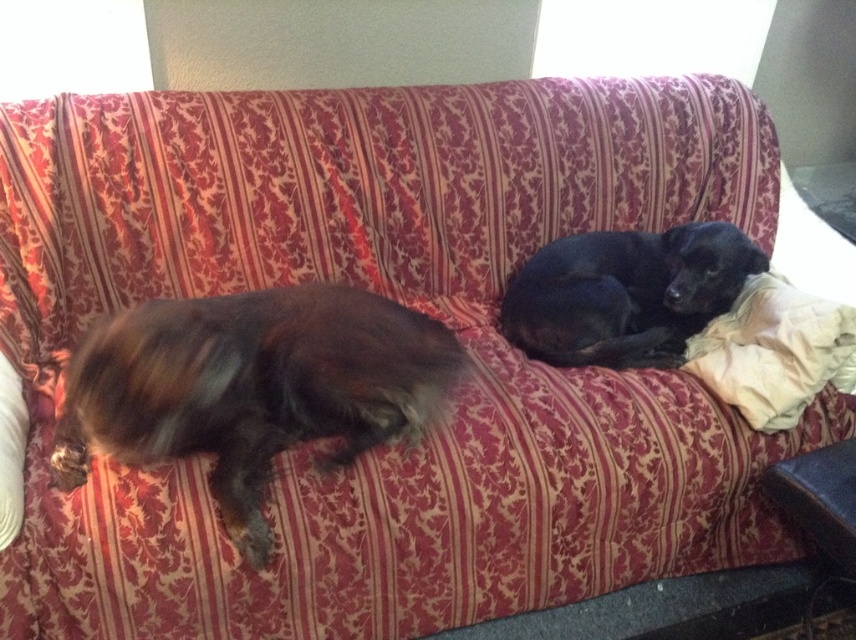
Question: Can you confirm if brown fuzzy dog at left is positioned above black smooth dog at right?

Choices:
 (A) yes
 (B) no

Answer: (B)

Question: Is black smooth dog at right wider than white cotton pillow at right?

Choices:
 (A) no
 (B) yes

Answer: (B)

Question: Among these objects, which one is nearest to the camera?

Choices:
 (A) white cotton pillow at right
 (B) brown fuzzy dog at left

Answer: (B)

Question: Which point is farther from the camera taking this photo?

Choices:
 (A) (646, 292)
 (B) (794, 371)
 (C) (86, 392)

Answer: (A)

Question: Observing the image, what is the correct spatial positioning of brown fuzzy dog at left in reference to black smooth dog at right?

Choices:
 (A) above
 (B) below

Answer: (B)

Question: Which of the following is the closest to the observer?

Choices:
 (A) (174, 394)
 (B) (794, 333)

Answer: (A)